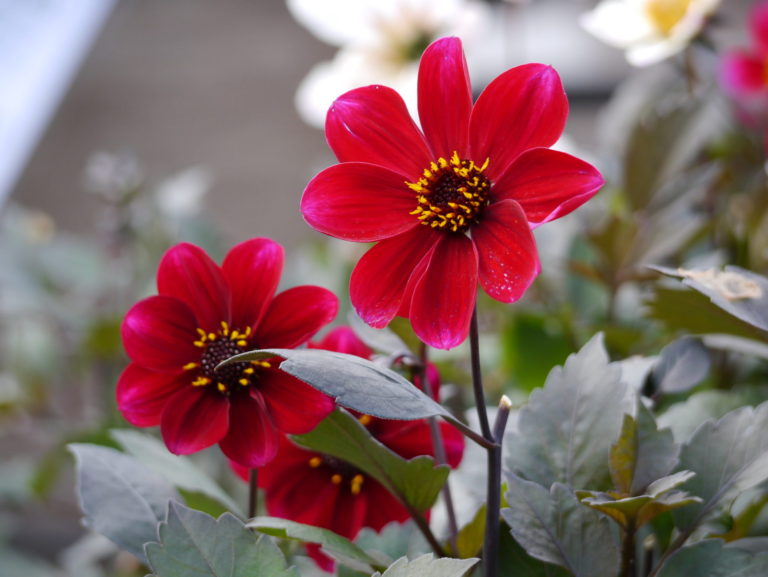
Image resolution: width=768 pixels, height=577 pixels. I want to click on right corner white flower, so click(x=650, y=48).